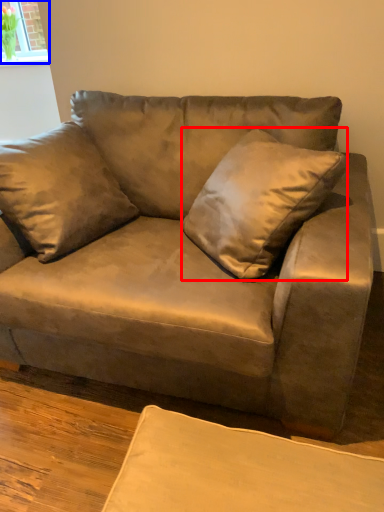
Question: Which of the following is the closest to the observer, throw pillow (highlighted by a red box) or window (highlighted by a blue box)?

Choices:
 (A) throw pillow
 (B) window

Answer: (A)